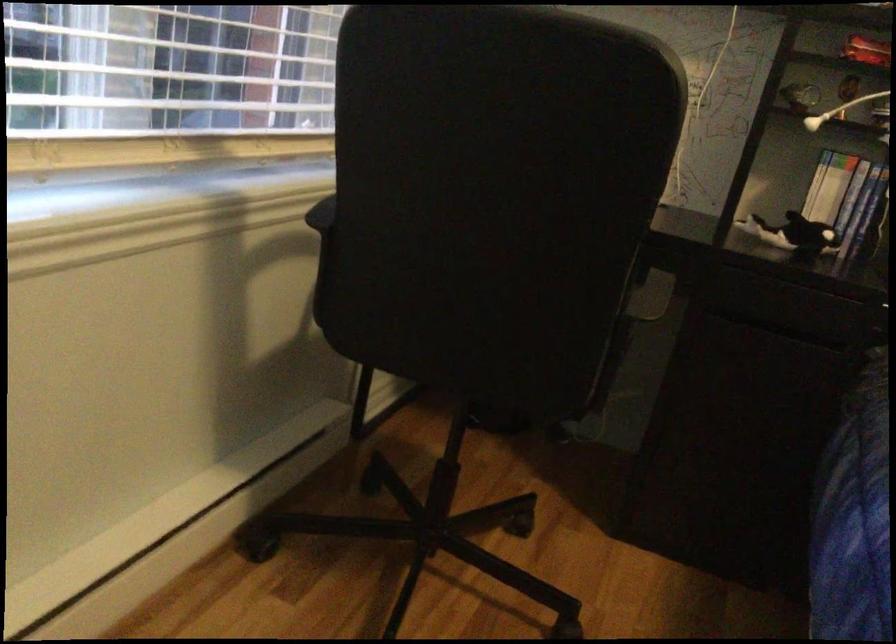
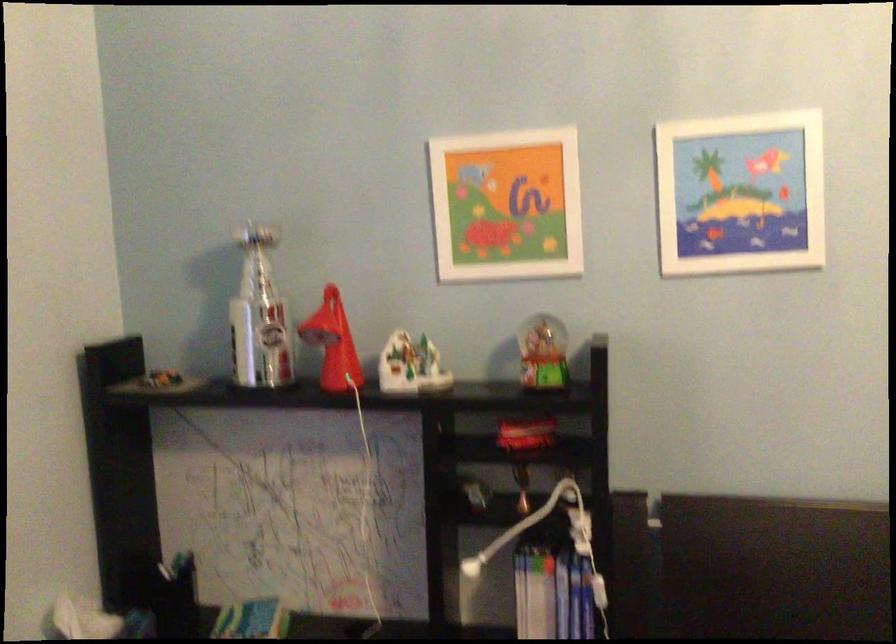
Which direction would the cameraman need to move to produce the second image?

The cameraman moved toward right, forward.